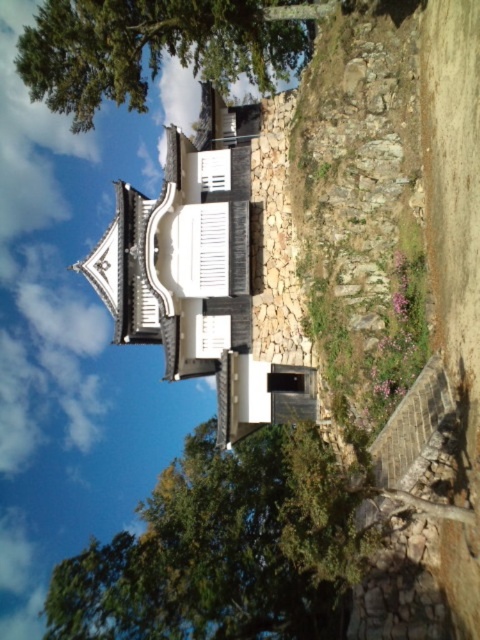
Question: From the image, what is the correct spatial relationship of green leafy tree at lower center in relation to green leafy tree at upper left?

Choices:
 (A) below
 (B) above

Answer: (A)

Question: From the image, what is the correct spatial relationship of green leafy tree at upper left in relation to white matte shutter at center?

Choices:
 (A) above
 (B) below

Answer: (A)

Question: Is green leafy tree at upper left positioned before white matte shutter at center?

Choices:
 (A) no
 (B) yes

Answer: (B)

Question: Which of these objects is positioned closest to the green leafy tree at lower center?

Choices:
 (A) white matte shutter at center
 (B) green leafy tree at upper left

Answer: (A)

Question: Which object appears closest to the camera in this image?

Choices:
 (A) white matte shutter at center
 (B) green leafy tree at upper left
 (C) green leafy tree at lower center

Answer: (C)

Question: Which of the following is the closest to the observer?

Choices:
 (A) (227, 630)
 (B) (24, 49)

Answer: (B)